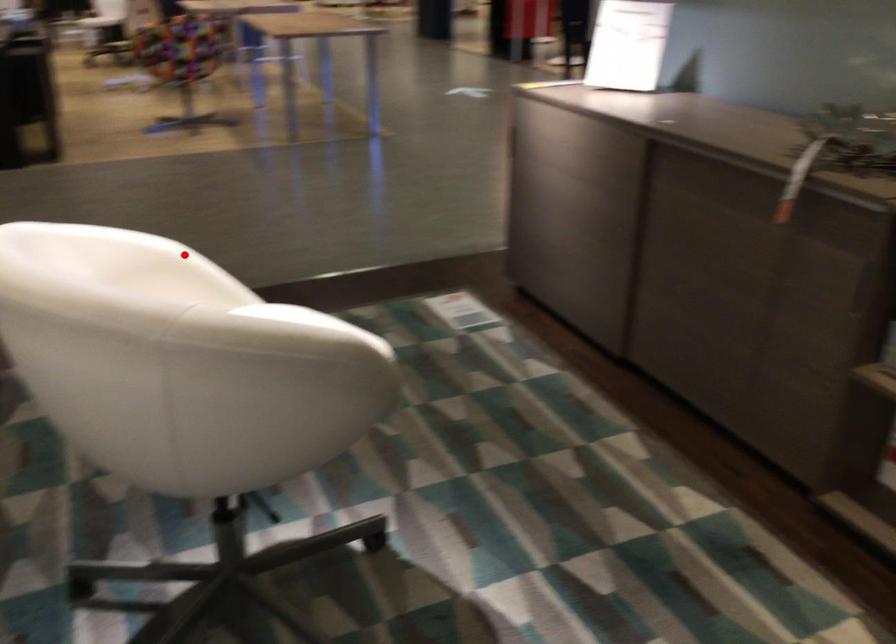
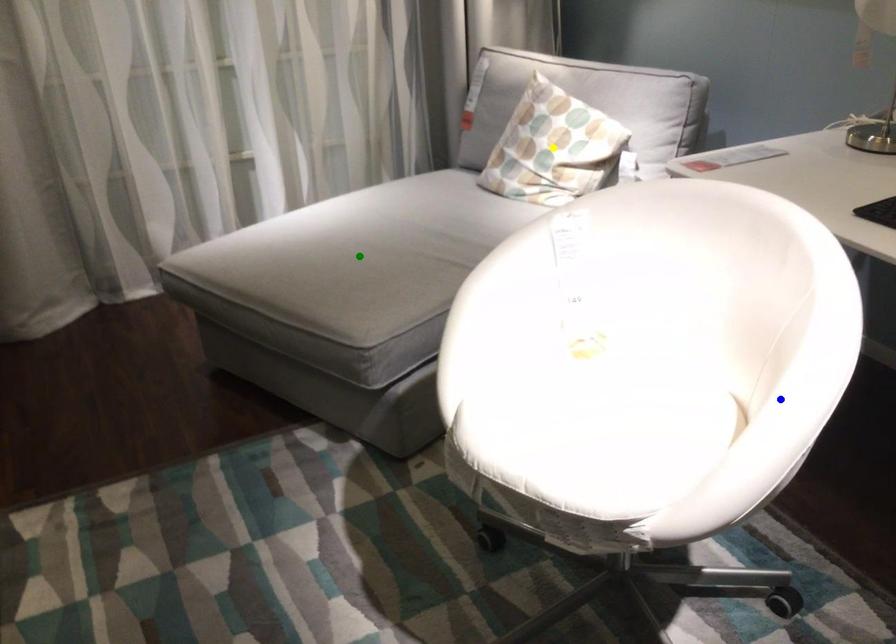
Question: I am providing you with two images of the same scene from different viewpoints. A red point is marked on the first image. You are given multiple points on the second image. In image 2, which mark is for the same physical point as the one in image 1?

Choices:
 (A) blue point
 (B) green point
 (C) yellow point

Answer: (A)